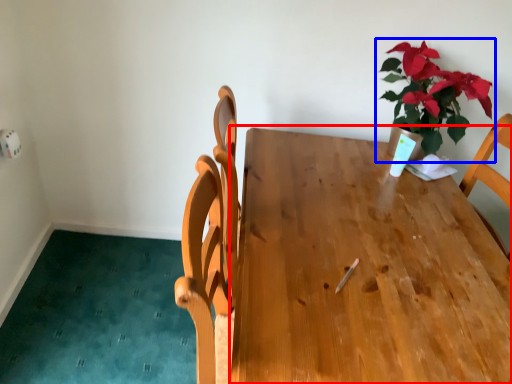
Question: Which object is further to the camera taking this photo, table (highlighted by a red box) or houseplant (highlighted by a blue box)?

Choices:
 (A) table
 (B) houseplant

Answer: (B)